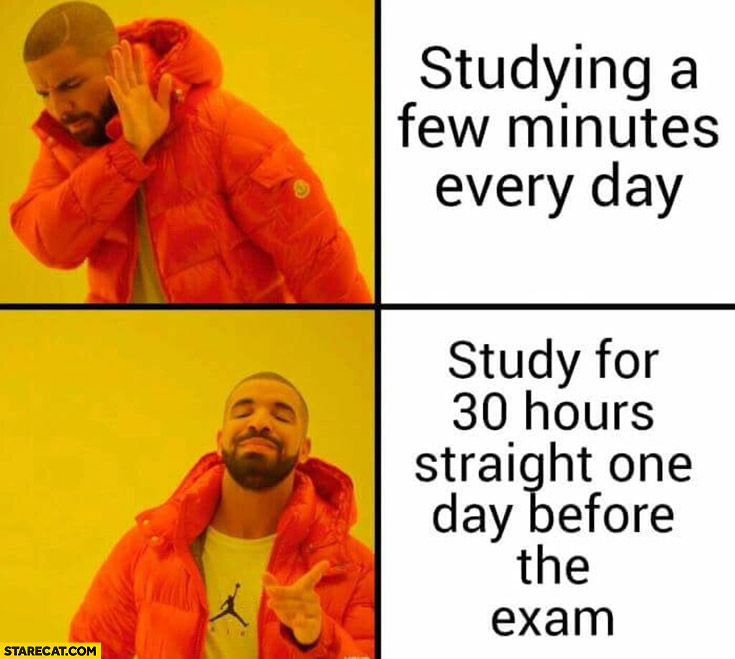
Locate an element on the screen. hood is located at coordinates (322, 488), (190, 37).